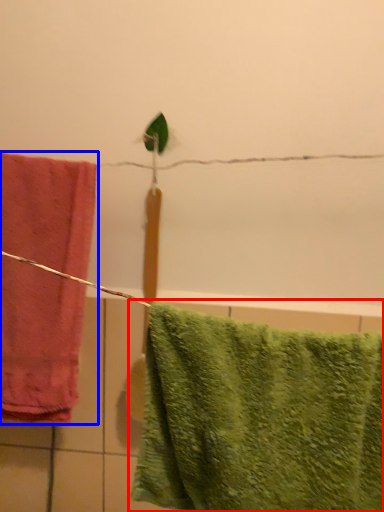
Question: Which of the following is the closest to the observer, towel (highlighted by a red box) or towel (highlighted by a blue box)?

Choices:
 (A) towel
 (B) towel

Answer: (A)